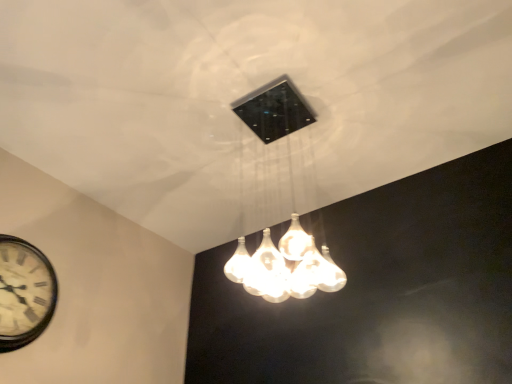
Describe the element at coordinates (292, 208) in the screenshot. I see `translucent glass chandelier at center` at that location.

Locate an element on the screen. translucent glass chandelier at center is located at coordinates (292, 208).

What do you see at coordinates (24, 293) in the screenshot?
I see `white wooden clock at lower left` at bounding box center [24, 293].

In order to face white wooden clock at lower left, should I rotate leftwards or rightwards?

To align with it, rotate left about 28.741°.

Where is `white wooden clock at lower left`? The width and height of the screenshot is (512, 384). white wooden clock at lower left is located at coordinates (24, 293).

Locate an element on the screen. This screenshot has height=384, width=512. translucent glass chandelier at center is located at coordinates (292, 208).

Looking at this image, does translucent glass chandelier at center appear on the left side of white wooden clock at lower left?

No, translucent glass chandelier at center is not to the left of white wooden clock at lower left.

Between translucent glass chandelier at center and white wooden clock at lower left, which one is positioned in front?

translucent glass chandelier at center is more forward.

Considering the points (250, 106) and (33, 336), which point is behind, point (250, 106) or point (33, 336)?

Positioned behind is point (250, 106).

From the image's perspective, is translucent glass chandelier at center beneath white wooden clock at lower left?

Actually, translucent glass chandelier at center appears above white wooden clock at lower left in the image.

From a real-world perspective, is translucent glass chandelier at center above or below white wooden clock at lower left?

translucent glass chandelier at center is above white wooden clock at lower left.

Is translucent glass chandelier at center wider than white wooden clock at lower left?

Yes.

Looking at this image, considering the relative sizes of translucent glass chandelier at center and white wooden clock at lower left in the image provided, is translucent glass chandelier at center shorter than white wooden clock at lower left?

No.

Based on the photo, is translucent glass chandelier at center bigger or smaller than white wooden clock at lower left?

translucent glass chandelier at center is bigger than white wooden clock at lower left.

Is translucent glass chandelier at center inside or outside of white wooden clock at lower left?

translucent glass chandelier at center is not inside white wooden clock at lower left, it's outside.

Is translucent glass chandelier at center far away from white wooden clock at lower left?

Yes, translucent glass chandelier at center is far from white wooden clock at lower left.

Is translucent glass chandelier at center looking in the opposite direction of white wooden clock at lower left?

That's not correct — translucent glass chandelier at center is not looking away from white wooden clock at lower left.

What's the angular difference between translucent glass chandelier at center and white wooden clock at lower left's facing directions?

90.3 degrees.

How distant is translucent glass chandelier at center from white wooden clock at lower left?

translucent glass chandelier at center is 3.62 feet away from white wooden clock at lower left.

At what (x,y) coordinates should I click in order to perform the action: click on lamp above the white wooden clock at lower left (from the image's perspective). Please return your answer as a coordinate pair (x, y). The height and width of the screenshot is (384, 512). Looking at the image, I should click on (292, 208).

Is white wooden clock at lower left to the left or to the right of translucent glass chandelier at center in the image?

white wooden clock at lower left is to the left of translucent glass chandelier at center.

Who is more distant, white wooden clock at lower left or translucent glass chandelier at center?

white wooden clock at lower left is further from the camera.

Which point is more forward, (33, 318) or (328, 291)?

The point (33, 318) is closer to the camera.

From the image's perspective, is white wooden clock at lower left under translucent glass chandelier at center?

Yes.

From a real-world perspective, which object stands above the other?

translucent glass chandelier at center, from a real-world perspective.

Looking at this image, considering the sizes of white wooden clock at lower left and translucent glass chandelier at center in the image, is white wooden clock at lower left wider or thinner than translucent glass chandelier at center?

white wooden clock at lower left is thinner than translucent glass chandelier at center.

Considering the sizes of objects white wooden clock at lower left and translucent glass chandelier at center in the image provided, who is taller, white wooden clock at lower left or translucent glass chandelier at center?

translucent glass chandelier at center is taller.

Consider the image. Looking at the image, does white wooden clock at lower left seem bigger or smaller compared to translucent glass chandelier at center?

Considering their sizes, white wooden clock at lower left takes up less space than translucent glass chandelier at center.

Would you say white wooden clock at lower left contains translucent glass chandelier at center?

No, translucent glass chandelier at center is located outside of white wooden clock at lower left.

Can you see white wooden clock at lower left touching translucent glass chandelier at center?

white wooden clock at lower left and translucent glass chandelier at center are not in contact.

Is white wooden clock at lower left turned away from translucent glass chandelier at center?

No.

How many degrees apart are the facing directions of white wooden clock at lower left and translucent glass chandelier at center?

They differ by 90.3 degrees in their facing directions.

I want to click on wall clock on the left of the translucent glass chandelier at center, so click(x=24, y=293).

The height and width of the screenshot is (384, 512). I want to click on wall clock to the left of translucent glass chandelier at center, so click(24, 293).

What are the coordinates of `lamp lying in front of the white wooden clock at lower left` in the screenshot? It's located at (292, 208).